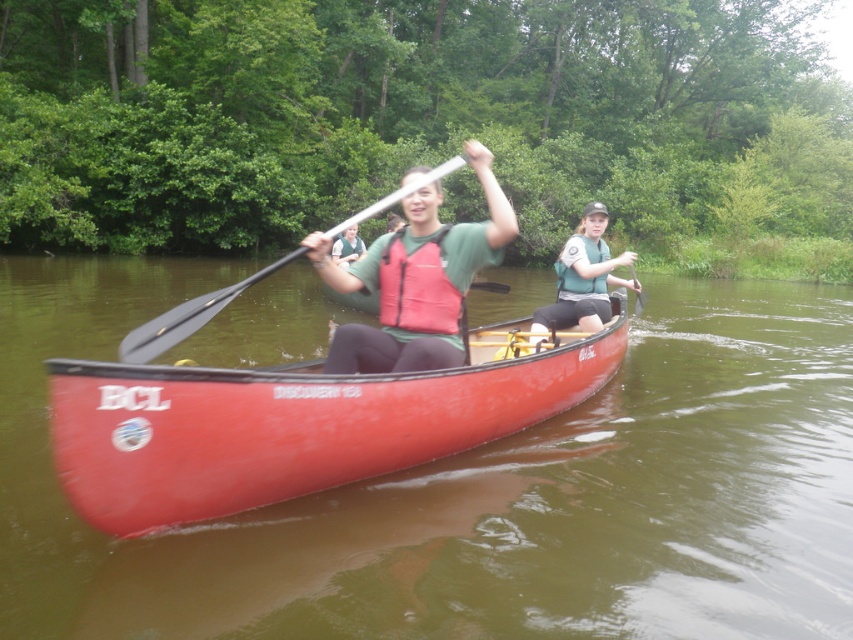
You are a safety inspector checking the canoe setup. The green matte life vest at center and the black plastic paddle at center are both essential items. According to safety regulations, the life vest must be worn and the paddle must be secured properly. Is the current arrangement compliant with safety standards?

The green matte life vest at center is below the black plastic paddle at center, which means the paddle is not secured properly as it is placed above the life vest. This violates safety regulations, so the arrangement is not compliant.

You are a photographer standing on the dock, and you want to capture a closeup shot of the black plastic paddle at center. Given that your camera has a maximum focus range of 4 meters, will you be able to focus on the paddle?

The black plastic paddle at center is 3.94 meters away from the camera. Since the maximum focus range is 4 meters, the camera can focus on the paddle as 3.94 meters is within the 4 meter limit.

What are the coordinates of the green matte life vest at center in the image?

The green matte life vest at center is located at coordinates point (583,278).